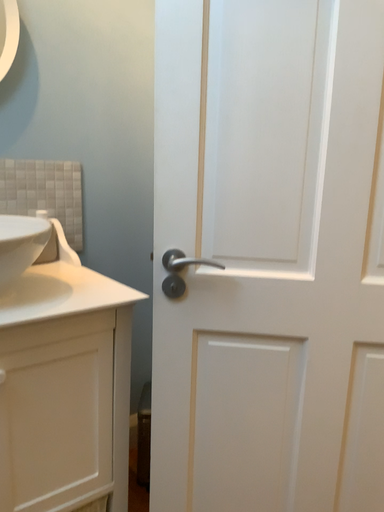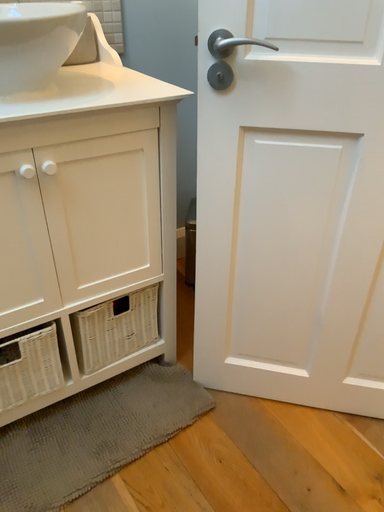
Question: Which way did the camera rotate in the video?

Choices:
 (A) rotated upward
 (B) rotated downward

Answer: (B)